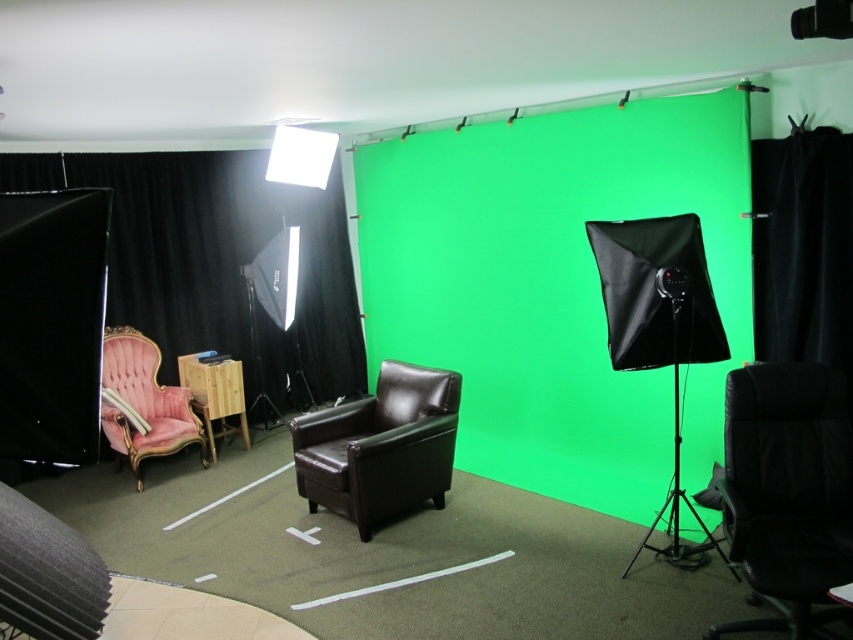
Question: Which point is farther from the camera taking this photo?

Choices:
 (A) (447, 250)
 (B) (343, 432)
 (C) (189, 209)

Answer: (C)

Question: Is green matte backdrop at center to the left of black velvet curtain at left from the viewer's perspective?

Choices:
 (A) no
 (B) yes

Answer: (A)

Question: Based on their relative distances, which object is farther from the brown leather swivel chair at center?

Choices:
 (A) black leather office chair at lower right
 (B) black fabric curtain at right
 (C) green matte backdrop at center
 (D) wooden side table at lower left

Answer: (B)

Question: Is black leather office chair at lower right above velvet pink armchair at left?

Choices:
 (A) yes
 (B) no

Answer: (B)

Question: Which object appears closest to the camera in this image?

Choices:
 (A) velvet pink armchair at left
 (B) black velvet curtain at left

Answer: (A)

Question: Is green matte backdrop at center thinner than black leather office chair at lower right?

Choices:
 (A) no
 (B) yes

Answer: (A)